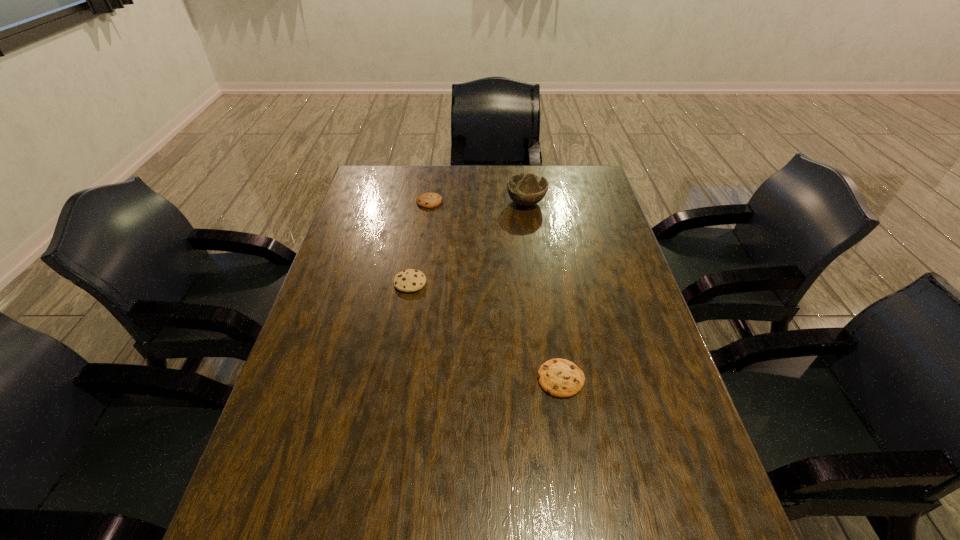
Identify which cookie is located as the nearest to the second tallest object. Please provide its 2D coordinates. Your answer should be formatted as a tuple, i.e. [(x, y)], where the tuple contains the x and y coordinates of a point satisfying the conditions above.

[(426, 200)]

Find the location of a particular element. vacant position in the image that satisfies the following two spatial constraints: 1. on the front side of the farthest cookie; 2. on the left side of the rightmost cookie is located at coordinates (403, 379).

Locate an element on the screen. This screenshot has width=960, height=540. vacant space that satisfies the following two spatial constraints: 1. on the back side of the farthest cookie; 2. on the left side of the second nearest cookie is located at coordinates (423, 202).